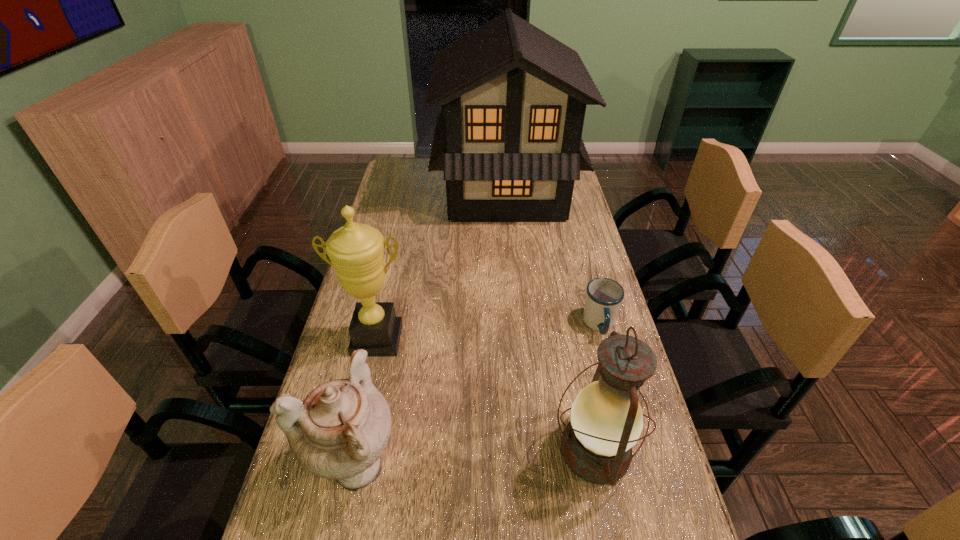
I want to click on vacant space at the left edge of the desktop, so click(396, 227).

This screenshot has height=540, width=960. Find the location of `vacant area at the right edge of the desktop`. vacant area at the right edge of the desktop is located at coordinates (658, 530).

In the image, there is a desktop. At what (x,y) coordinates should I click in order to perform the action: click on vacant area at the far left corner. Please return your answer as a coordinate pair (x, y). Looking at the image, I should click on (387, 183).

The height and width of the screenshot is (540, 960). I want to click on free spot between the oil lamp and the trophy cup, so click(486, 395).

You are a GUI agent. You are given a task and a screenshot of the screen. Output one action in this format:
    pyautogui.click(x=<x>, y=<y>)
    Task: Click on the vacant region between the second shortest object and the oil lamp
    The width and height of the screenshot is (960, 540).
    Given the screenshot: What is the action you would take?
    pyautogui.click(x=475, y=457)

Locate an element on the screen. free point between the mug and the trophy cup is located at coordinates (489, 332).

Locate an element on the screen. The image size is (960, 540). empty space that is in between the shortest object and the trophy cup is located at coordinates (489, 332).

Identify the location of vacant area that lies between the oil lamp and the urn. (475, 457).

The height and width of the screenshot is (540, 960). I want to click on object that stands as the third closest to the mug, so click(x=356, y=251).

Find the location of `object that is the second closest one to the fourth tallest object`. object that is the second closest one to the fourth tallest object is located at coordinates (606, 421).